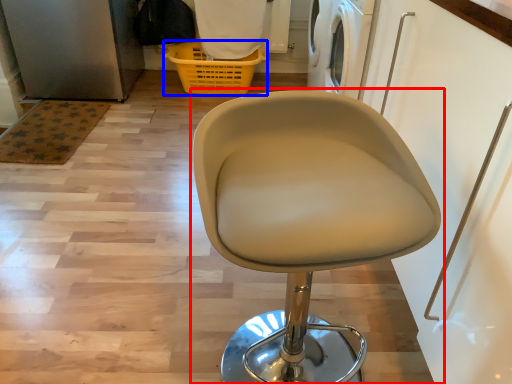
Question: Which of the following is the farthest to the observer, chair (highlighted by a red box) or basket (highlighted by a blue box)?

Choices:
 (A) chair
 (B) basket

Answer: (B)